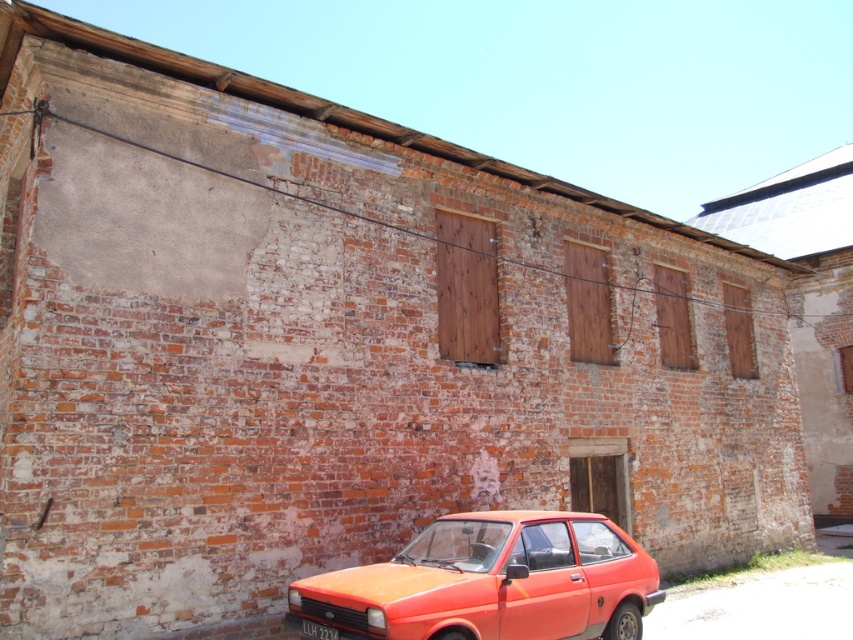
Which is in front, point (361, 628) or point (318, 637)?

Point (361, 628) is more forward.

Locate an element on the screen. The height and width of the screenshot is (640, 853). orange matte car at lower center is located at coordinates (491, 582).